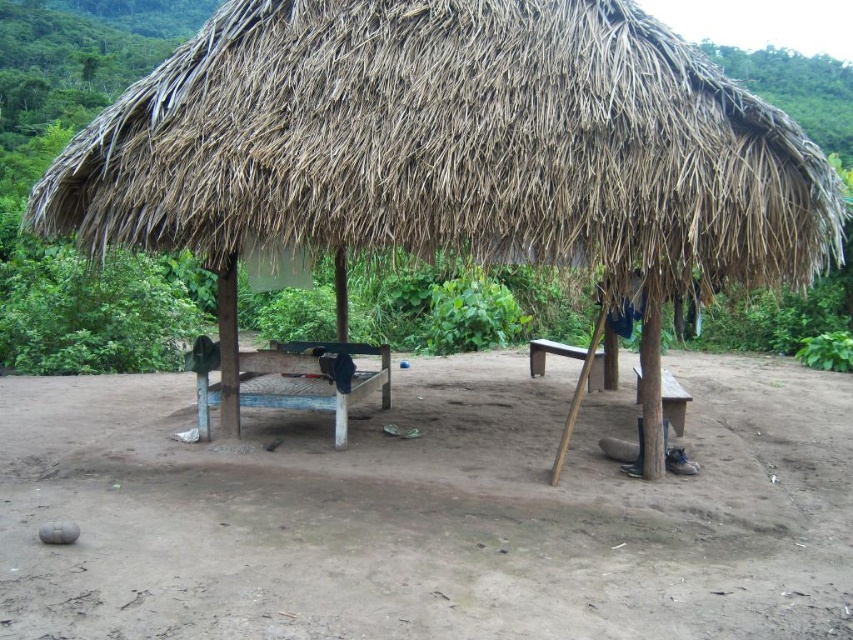
Question: Which point is farther from the camera taking this photo?

Choices:
 (A) (97, 602)
 (B) (263, 403)
 (C) (495, 188)

Answer: (B)

Question: Which point appears closest to the camera in this image?

Choices:
 (A) (317, 355)
 (B) (810, 272)
 (C) (219, 547)

Answer: (C)

Question: Which object is closer to the camera taking this photo?

Choices:
 (A) brown dirt field at center
 (B) dry straw roof at upper center
 (C) wooden picnic table at center

Answer: (A)

Question: From the image, what is the correct spatial relationship of brown dirt field at center in relation to wooden picnic table at center?

Choices:
 (A) right
 (B) left

Answer: (A)

Question: Is brown dirt field at center positioned at the back of wooden picnic table at center?

Choices:
 (A) yes
 (B) no

Answer: (B)

Question: Is brown dirt field at center to the left of wooden picnic table at center from the viewer's perspective?

Choices:
 (A) no
 (B) yes

Answer: (A)